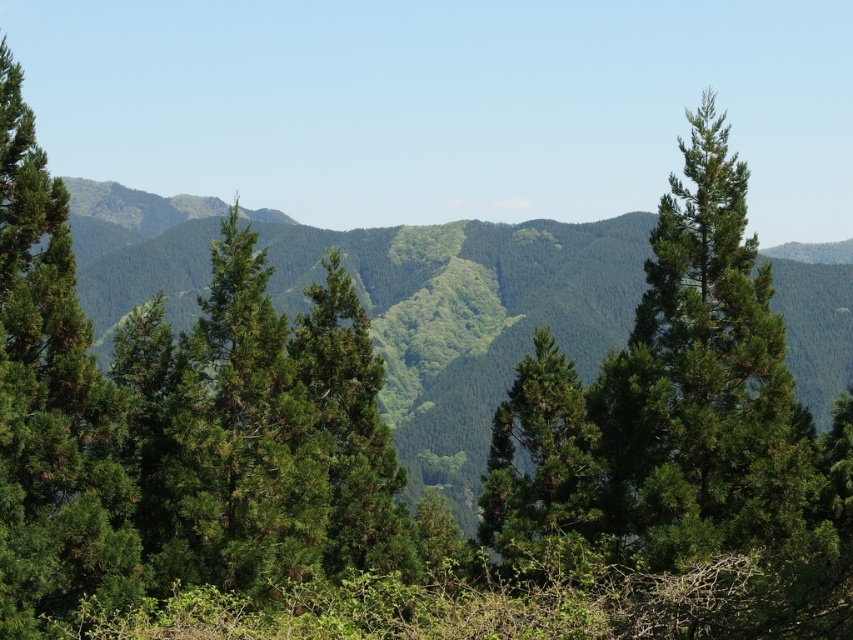
Does green matte tree at left have a lesser height compared to green matte tree at center?

No.

How far apart are green matte tree at left and green matte tree at center?

green matte tree at left and green matte tree at center are 39.80 feet apart.

Which is behind, point (35, 220) or point (531, 547)?

Point (531, 547)

Image resolution: width=853 pixels, height=640 pixels. I want to click on green matte tree at left, so click(x=51, y=404).

Does green textured tree at center appear over green matte tree at center?

Correct, green textured tree at center is located above green matte tree at center.

Locate an element on the screen. Image resolution: width=853 pixels, height=640 pixels. green textured tree at center is located at coordinates (238, 438).

Can you confirm if green matte tree at left is wider than green textured tree at center?

Yes, green matte tree at left is wider than green textured tree at center.

What do you see at coordinates (51, 404) in the screenshot?
I see `green matte tree at left` at bounding box center [51, 404].

Image resolution: width=853 pixels, height=640 pixels. What are the coordinates of `green matte tree at left` in the screenshot? It's located at (51, 404).